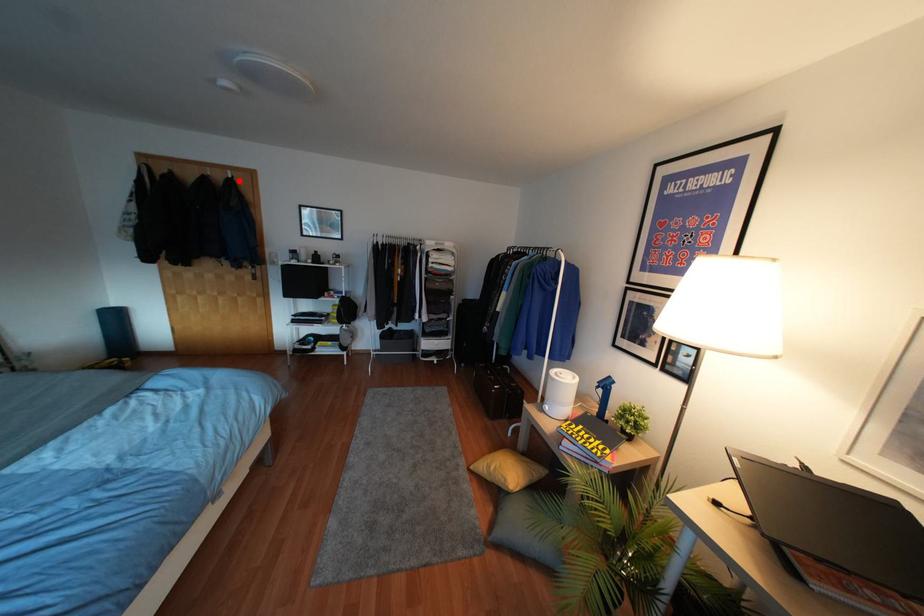
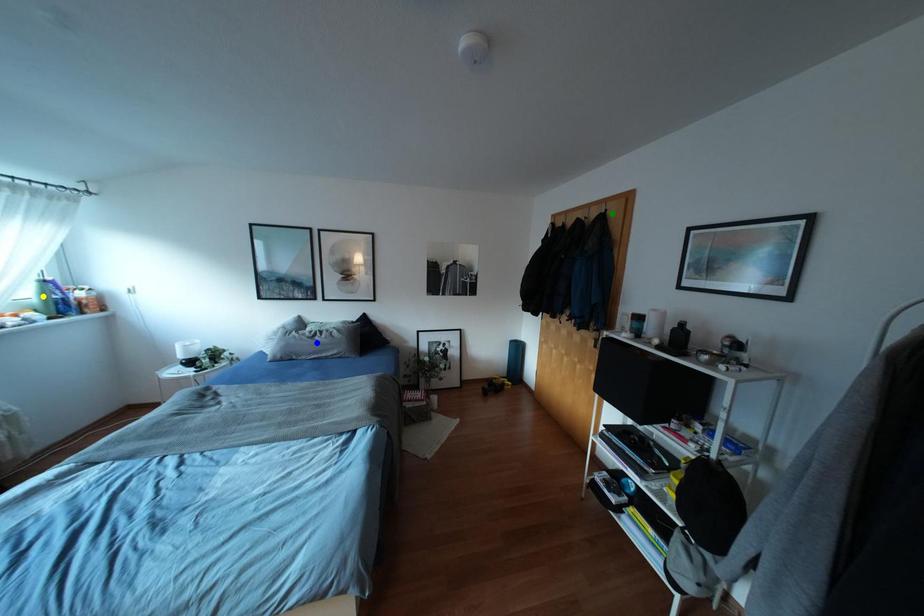
Question: I am providing you with two images of the same scene from different viewpoints. A red point is marked on the first image. You are given multiple points on the second image. Can you choose the point in image 2 that corresponds to the point in image 1?

Choices:
 (A) green point
 (B) yellow point
 (C) blue point

Answer: (A)